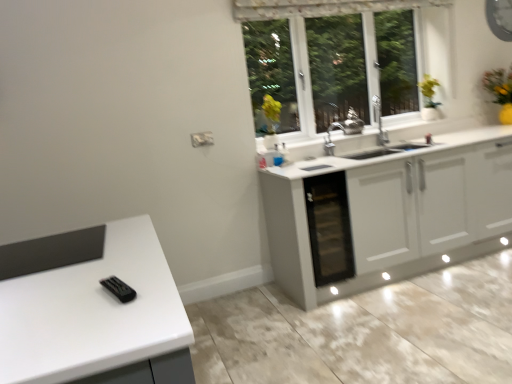
At what (x,y) coordinates should I click in order to perform the action: click on matte black dishwasher at center. Please return your answer as a coordinate pair (x, y). The image size is (512, 384). Looking at the image, I should click on (329, 228).

Describe the element at coordinates (329, 228) in the screenshot. I see `matte black dishwasher at center` at that location.

Where is `matte black dishwasher at center`? The height and width of the screenshot is (384, 512). matte black dishwasher at center is located at coordinates (329, 228).